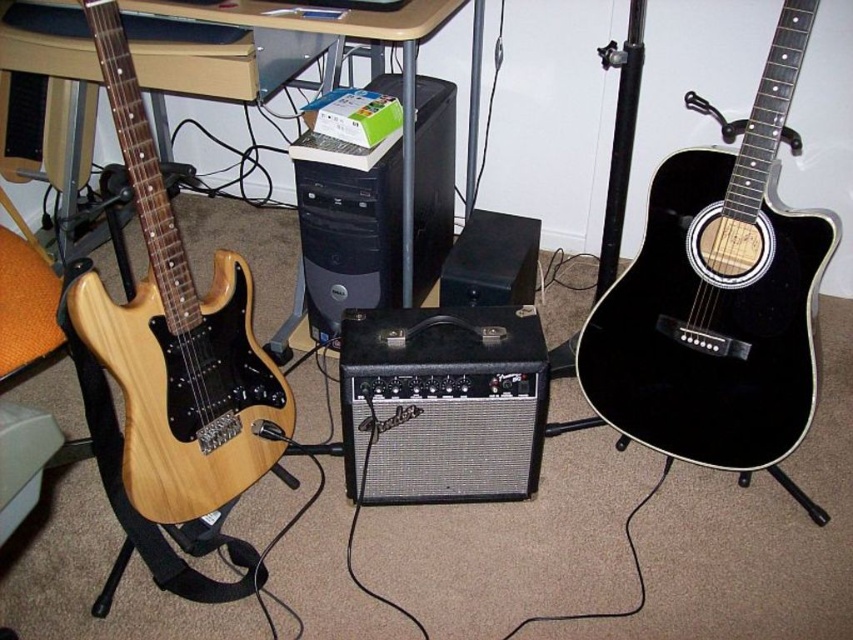
You are a musician who needs to move your natural wood electric guitar at left closer to the black plastic computer tower at center for a better sound setup. How much space do you need to adjust between them?

The distance between the natural wood electric guitar at left and the black plastic computer tower at center is 17.92 inches, so you need to adjust the space by moving them closer or farther apart by that measurement.

You are setting up a music studio and need to place the black mesh speaker at center and the black matte speaker at center in a rack. Which speaker should be placed first if you want to utilize vertical space efficiently?

The black mesh speaker at center should be placed first because it is larger in size compared to the black matte speaker at center, allowing for better use of vertical space by placing the larger one at the bottom.

You are setting up a music studio and need to place both the black mesh speaker at center and the black matte speaker at center side by side on a shelf. Given that the shelf has a width of 1 meter, can both speakers fit if placed next to each other?

The black mesh speaker at center is wider than the black matte speaker at center. Since the total width of both speakers combined would exceed the 1 meter shelf width, they cannot both fit side by side.